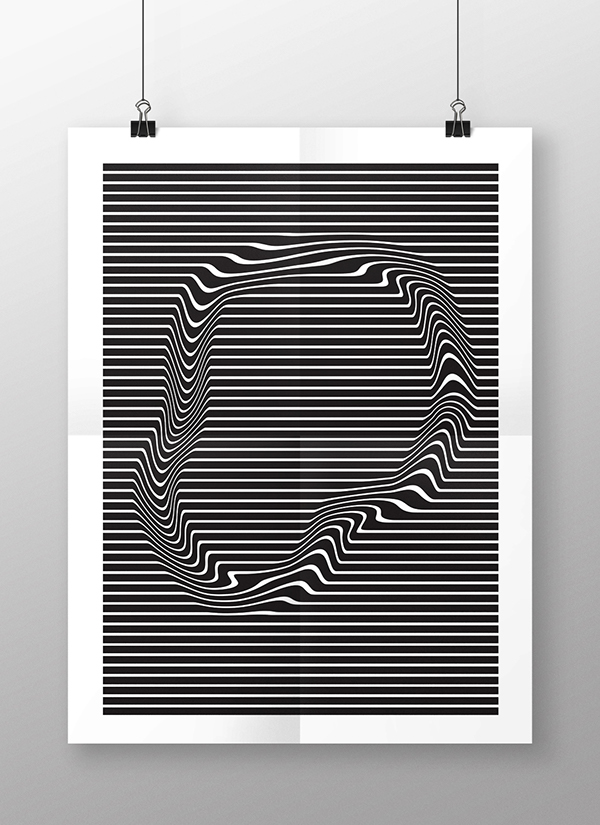
Locate an element on the screen. wires is located at coordinates (453, 25), (139, 39).